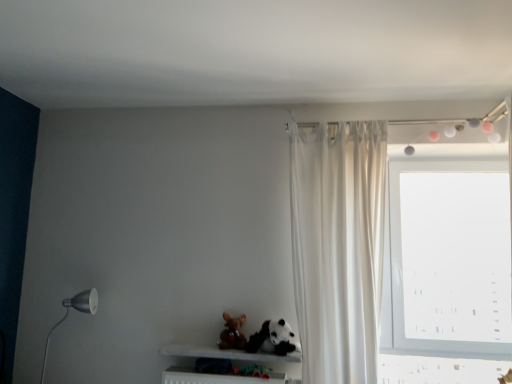
Question: In terms of width, does white marble shelf at lower center look wider or thinner when compared to matte black lamp at left?

Choices:
 (A) thin
 (B) wide

Answer: (B)

Question: Is point (228, 349) positioned closer to the camera than point (62, 299)?

Choices:
 (A) closer
 (B) farther

Answer: (A)

Question: Which object is the farthest from the white marble shelf at lower center?

Choices:
 (A) black plush panda at lower center
 (B) white silky curtain at right
 (C) transparent glass window at upper right
 (D) matte black lamp at left
 (E) velvety brown teddy bear at lower center

Answer: (C)

Question: Considering the real-world distances, which object is farthest from the black plush panda at lower center?

Choices:
 (A) transparent glass window at upper right
 (B) velvety brown teddy bear at lower center
 (C) matte black lamp at left
 (D) white marble shelf at lower center
 (E) white silky curtain at right

Answer: (A)